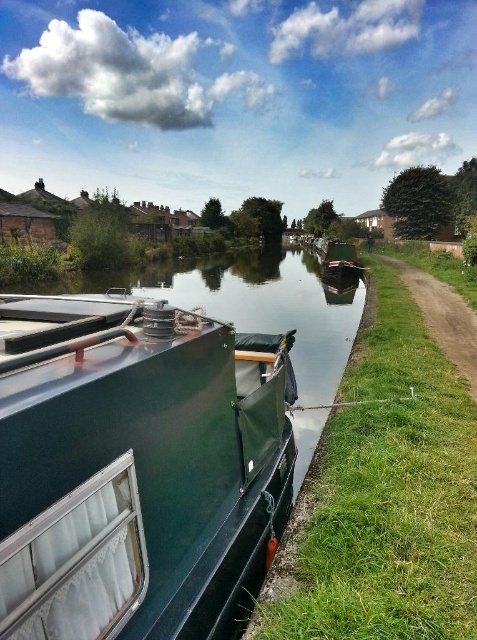
You are a photographer planning to capture the canal scene. You want to ensure both the green matte boat at lower left and the green matte boat at center are clearly visible in your shot. Which boat should you focus on to ensure it takes up more of the frame?

The green matte boat at center should be focused on because it occupies more space than the green matte boat at lower left, allowing it to take up more of the frame.

You are a delivery person needing to load a package onto the green matte boat at lower left and the green rubber boat at center. Which boat requires a shorter ladder to reach its deck?

The green matte boat at lower left has a lesser height compared to the green rubber boat at center, so you should use a shorter ladder for the green matte boat at lower left.

You are a tourist standing on the grassy towpath on the right side of the canal. You want to take a photo of both the green matte boat at lower left and the green rubber boat at center in the same frame. Which boat should you position closer to the camera to ensure both are visible in the photo?

You should position yourself closer to the green matte boat at lower left since it is to the left of the green rubber boat at center, making it closer to your position on the right side of the canal.